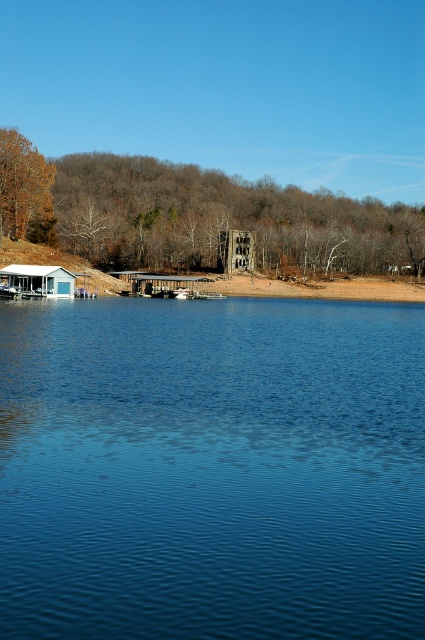
Question: Is wooden cabin at center above metallic gray dock at center?

Choices:
 (A) yes
 (B) no

Answer: (A)

Question: Which of these objects is positioned farthest from the blue liquid water at center?

Choices:
 (A) metallic gray dock at center
 (B) wooden cabin at center

Answer: (B)

Question: Among these points, which one is farthest from the camera?

Choices:
 (A) (175, 276)
 (B) (289, 404)

Answer: (A)

Question: Where is blue liquid water at center located in relation to white wood cabin at lower left in the image?

Choices:
 (A) below
 (B) above

Answer: (A)

Question: Based on their relative distances, which object is nearer to the blue liquid water at center?

Choices:
 (A) metallic gray dock at center
 (B) wooden cabin at center
 (C) white wood cabin at lower left

Answer: (C)

Question: Does white wood cabin at lower left have a greater width compared to wooden cabin at center?

Choices:
 (A) yes
 (B) no

Answer: (A)